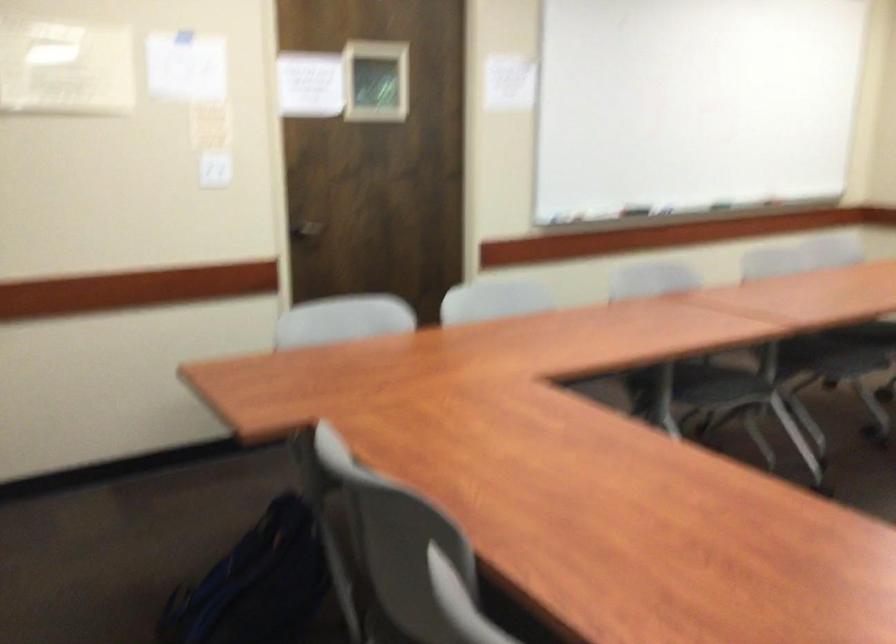
The width and height of the screenshot is (896, 644). What do you see at coordinates (306, 228) in the screenshot?
I see `the door handle` at bounding box center [306, 228].